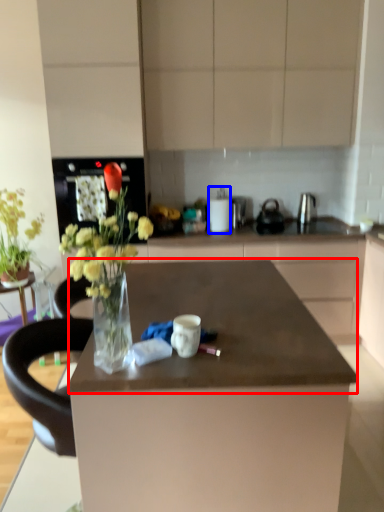
Question: Which object is closer to the camera taking this photo, countertop (highlighted by a red box) or appliance (highlighted by a blue box)?

Choices:
 (A) countertop
 (B) appliance

Answer: (A)